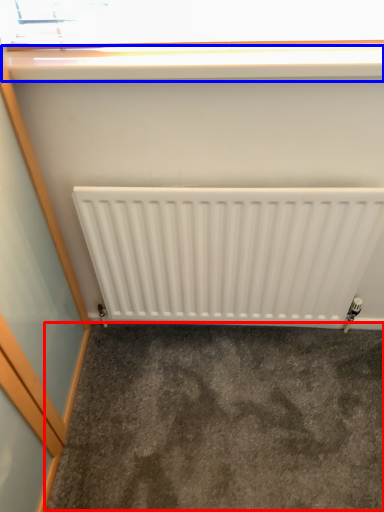
Question: Among these objects, which one is nearest to the camera, concrete (highlighted by a red box) or window sill (highlighted by a blue box)?

Choices:
 (A) concrete
 (B) window sill

Answer: (B)